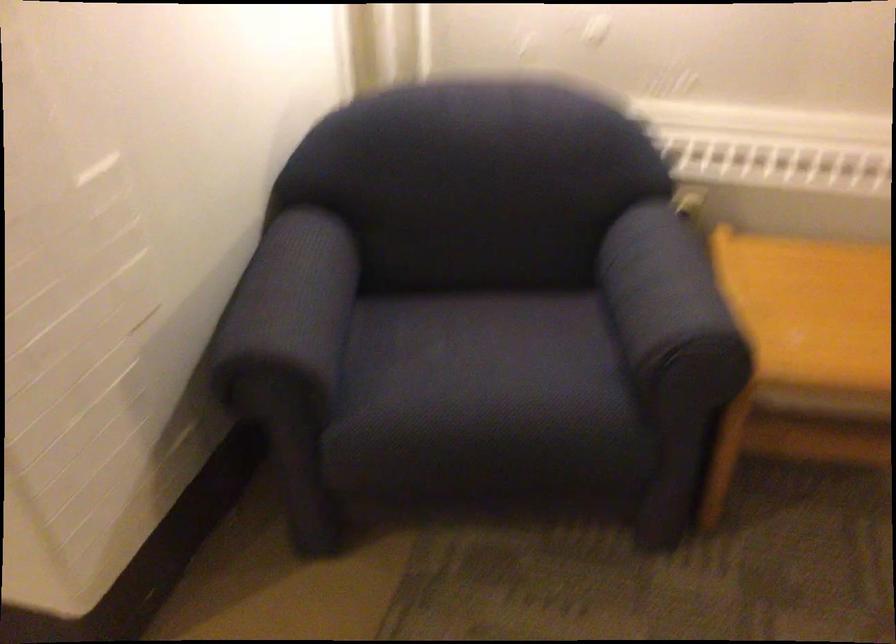
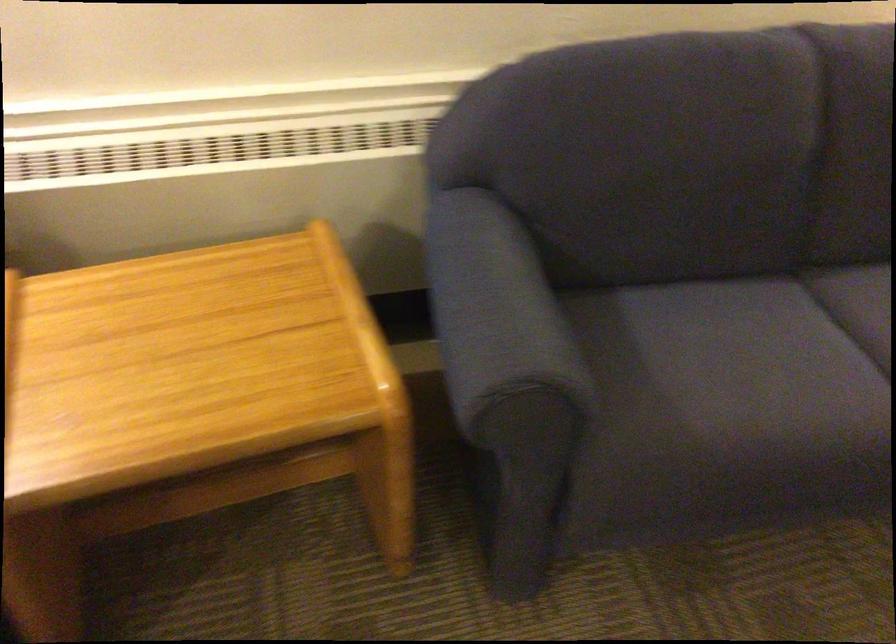
Question: What movement of the cameraman would produce the second image?

Choices:
 (A) Left
 (B) Right
 (C) Forward
 (D) Backward

Answer: (B)